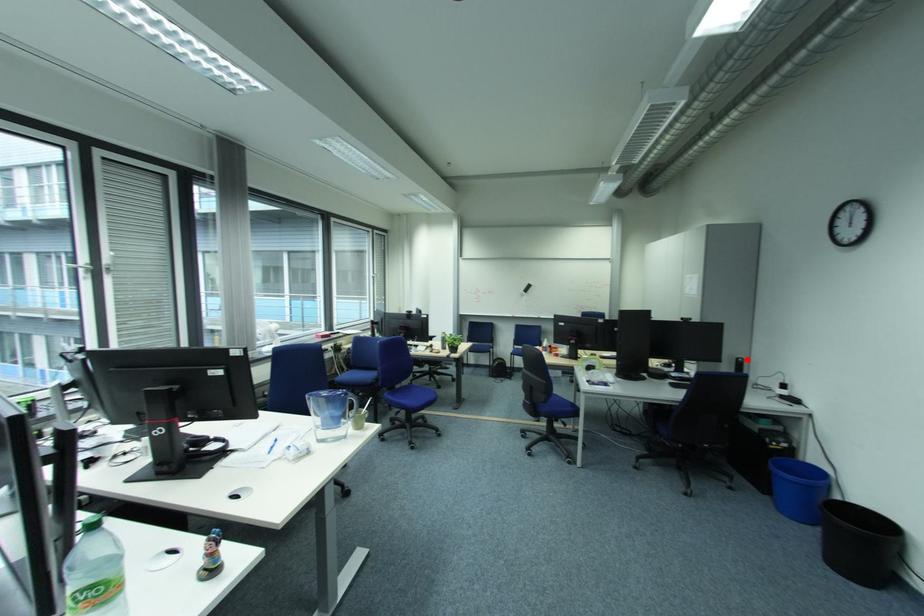
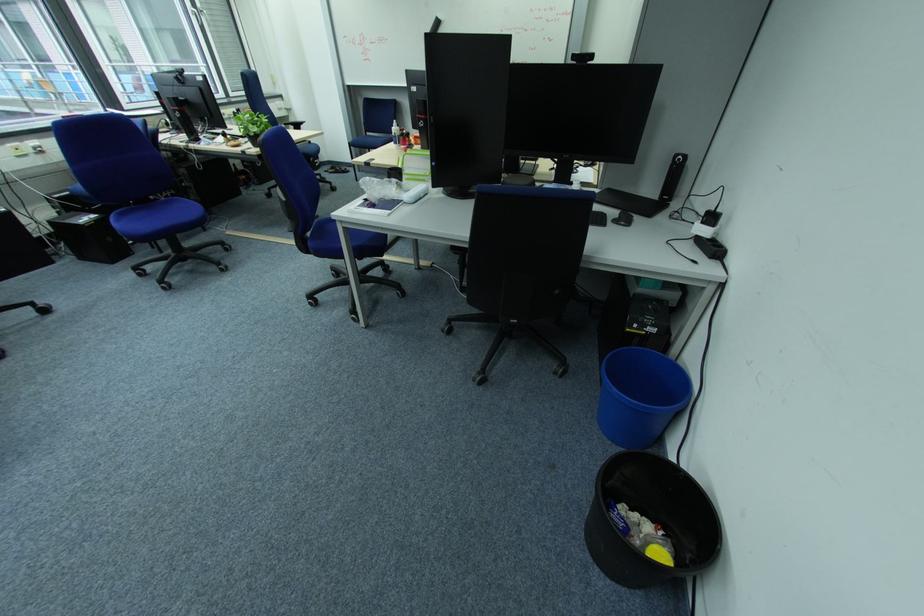
Where in the second image is the point corresponding to the highlighted location from the first image?

(686, 156)